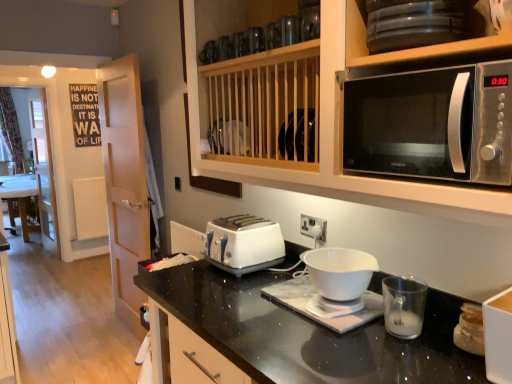
The width and height of the screenshot is (512, 384). In order to click on white plastic electric outlet at center in this screenshot , I will do click(313, 227).

What do you see at coordinates (313, 296) in the screenshot? I see `white glossy bowl at center, which is the 1th appliance in back-to-front order` at bounding box center [313, 296].

This screenshot has height=384, width=512. What do you see at coordinates (125, 183) in the screenshot?
I see `white glossy door at left` at bounding box center [125, 183].

The width and height of the screenshot is (512, 384). What do you see at coordinates (404, 306) in the screenshot? I see `clear glass measuring cup at right, marked as the first appliance in a front-to-back arrangement` at bounding box center [404, 306].

What do you see at coordinates (432, 124) in the screenshot? I see `satin silver microwave at upper right` at bounding box center [432, 124].

Measure the distance between white plastic toaster at center and camera.

white plastic toaster at center is 1.72 meters away from camera.

Locate an element on the screen. The width and height of the screenshot is (512, 384). white glossy table at left is located at coordinates (21, 197).

Is white plastic toaster at center facing away from white plastic electric outlet at center?

white plastic toaster at center is not turned away from white plastic electric outlet at center.

Where is `electric outlet behind the white plastic toaster at center`? The width and height of the screenshot is (512, 384). electric outlet behind the white plastic toaster at center is located at coordinates (313, 227).

From the image's perspective, which is above, white plastic toaster at center or white plastic electric outlet at center?

white plastic electric outlet at center appears higher in the image.

Between white plastic toaster at center and white plastic electric outlet at center, which one has more height?

With more height is white plastic toaster at center.

Are white glossy bowl at center, the 2th appliance positioned from the front, and satin silver microwave at upper right making contact?

There is a gap between white glossy bowl at center, the 2th appliance positioned from the front, and satin silver microwave at upper right.

Considering the points (296, 301) and (200, 160), which point is behind, point (296, 301) or point (200, 160)?

The point (200, 160) is farther from the camera.

Can you tell me how much white glossy bowl at center, the 2th appliance positioned from the front, and satin silver microwave at upper right differ in facing direction?

0.336 degrees separate the facing orientations of white glossy bowl at center, the 2th appliance positioned from the front, and satin silver microwave at upper right.

Does white glossy table at left come behind white plastic electric outlet at center?

Yes, white glossy table at left is further from the camera.

Which point is more distant from viewer, (x=29, y=191) or (x=318, y=221)?

Point (x=29, y=191)

How distant is white glossy table at left from white plastic electric outlet at center?

A distance of 4.79 meters exists between white glossy table at left and white plastic electric outlet at center.

Considering the relative positions of white glossy table at left and white plastic electric outlet at center in the image provided, is white glossy table at left to the left of white plastic electric outlet at center from the viewer's perspective?

Correct, you'll find white glossy table at left to the left of white plastic electric outlet at center.

From the image's perspective, who appears lower, white glossy door at left or white plastic mixing bowl at center?

white plastic mixing bowl at center.

Which object is further away from the camera, white glossy door at left or white plastic mixing bowl at center?

white glossy door at left is behind.

Would you say white glossy door at left is outside white plastic mixing bowl at center?

Indeed, white glossy door at left is completely outside white plastic mixing bowl at center.

Is white glossy door at left thinner than white plastic mixing bowl at center?

Yes, white glossy door at left is thinner than white plastic mixing bowl at center.

Which is in front, point (308, 252) or point (35, 228)?

The point (308, 252) is closer.

Considering the sizes of objects white plastic mixing bowl at center and white glossy table at left in the image provided, who is wider, white plastic mixing bowl at center or white glossy table at left?

With larger width is white glossy table at left.

Who is more distant, white plastic mixing bowl at center or white glossy table at left?

Positioned behind is white glossy table at left.

Is white plastic mixing bowl at center bigger or smaller than white glossy table at left?

Clearly, white plastic mixing bowl at center is smaller in size than white glossy table at left.

Considering the points (323, 233) and (199, 379), which point is behind, point (323, 233) or point (199, 379)?

The point (323, 233) is farther from the camera.

Which of these two, white plastic electric outlet at center or white plastic drawer at lower center, is smaller?

white plastic electric outlet at center.

Is white plastic electric outlet at center spatially inside white plastic drawer at lower center, or outside of it?

white plastic electric outlet at center is spatially situated outside white plastic drawer at lower center.

What's the angular difference between white plastic electric outlet at center and white plastic drawer at lower center's facing directions?

0.56 degrees.

From the image's perspective, relative to satin silver microwave at upper right, is white plastic electric outlet at center above or below?

Based on their image positions, white plastic electric outlet at center is located beneath satin silver microwave at upper right.

Is white plastic electric outlet at center taller than satin silver microwave at upper right?

No, white plastic electric outlet at center is not taller than satin silver microwave at upper right.

At what (x,y) coordinates should I click in order to perform the action: click on electric outlet that appears below the satin silver microwave at upper right (from a real-world perspective). Please return your answer as a coordinate pair (x, y). Looking at the image, I should click on (313, 227).

Is point (303, 223) positioned before point (357, 141)?

No, it is not.

Locate an element on the screen. The width and height of the screenshot is (512, 384). toaster in front of the white plastic electric outlet at center is located at coordinates (244, 244).

Identify the location of cabinetry located on the left of white glossy bowl at center, the 2th appliance positioned from the front. (333, 142).

In the scene shown: From the image, which object appears to be nearer to satin silver microwave at upper right, white glossy door at left or white glossy bowl at center, which is the 1th appliance in back-to-front order?

white glossy bowl at center, which is the 1th appliance in back-to-front order.

Based on the photo, which object lies further to the anchor point white plastic drawer at lower center, white glossy bowl at center, which is the 1th appliance in back-to-front order, or white plastic mixing bowl at center?

white plastic mixing bowl at center is further to white plastic drawer at lower center.

Looking at this image, which object lies nearer to the anchor point white glossy table at left, satin silver microwave at upper right or white plastic mixing bowl at center?

white plastic mixing bowl at center lies closer to white glossy table at left than the other object.

From the image, which object appears to be farther from white plastic drawer at lower center, white plastic mixing bowl at center or white glossy bowl at center, the 2th appliance positioned from the front?

Among the two, white plastic mixing bowl at center is located further to white plastic drawer at lower center.

Looking at the image, which one is located closer to white plastic mixing bowl at center, white plastic toaster at center or white glossy bowl at center, which is the 1th appliance in back-to-front order?

white glossy bowl at center, which is the 1th appliance in back-to-front order, is positioned closer to the anchor white plastic mixing bowl at center.

Estimate the real-world distances between objects in this image. Which object is closer to clear glass measuring cup at right, marked as the first appliance in a front-to-back arrangement, white plastic electric outlet at center or satin silver microwave at upper right?

white plastic electric outlet at center is positioned closer to the anchor clear glass measuring cup at right, marked as the first appliance in a front-to-back arrangement.

Based on their spatial positions, is white plastic drawer at lower center or white plastic toaster at center further from satin silver microwave at upper right?

Among the two, white plastic drawer at lower center is located further to satin silver microwave at upper right.

When comparing their distances from white glossy door at left, does white plastic mixing bowl at center or white glossy table at left seem further?

white glossy table at left is positioned further to the anchor white glossy door at left.

Where is `drawer between satin silver microwave at upper right and white glossy door at left along the z-axis`? drawer between satin silver microwave at upper right and white glossy door at left along the z-axis is located at coordinates (198, 359).

Where is `electric outlet positioned between white glossy bowl at center, the 2th appliance positioned from the front, and white glossy table at left from near to far`? This screenshot has width=512, height=384. electric outlet positioned between white glossy bowl at center, the 2th appliance positioned from the front, and white glossy table at left from near to far is located at coordinates (313, 227).

The image size is (512, 384). I want to click on electric outlet positioned between white plastic toaster at center and white glossy table at left from near to far, so click(313, 227).

Where is `glass door between white plastic mixing bowl at center and white glossy table at left in the front-back direction`? Image resolution: width=512 pixels, height=384 pixels. glass door between white plastic mixing bowl at center and white glossy table at left in the front-back direction is located at coordinates (125, 183).